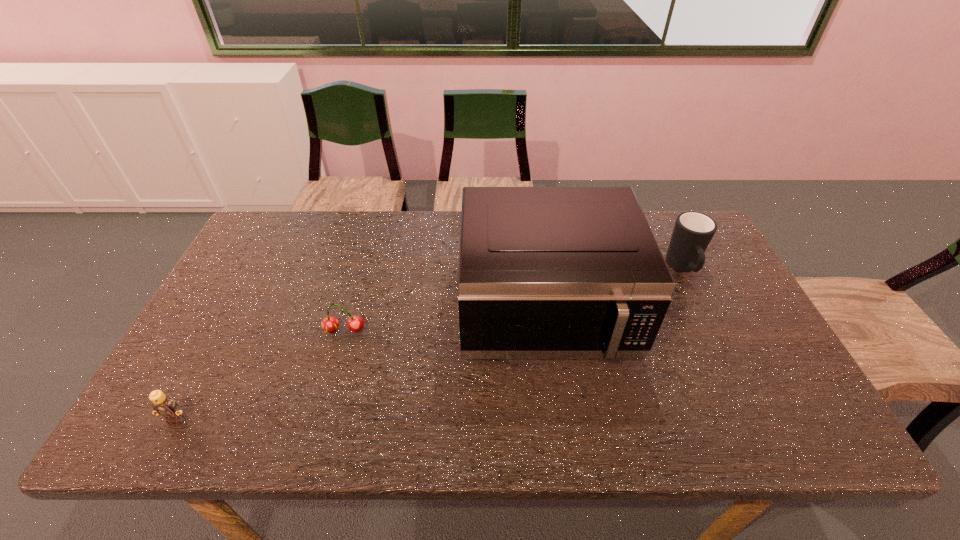
At what (x,y) coordinates should I click in order to perform the action: click on free space between the tallest object and the cherry. Please return your answer as a coordinate pair (x, y). The width and height of the screenshot is (960, 540). Looking at the image, I should click on (444, 322).

What are the coordinates of `empty location between the third object from right to left and the leftmost object` in the screenshot? It's located at (x=260, y=374).

Locate an element on the screen. The height and width of the screenshot is (540, 960). vacant point located between the rightmost object and the nearest object is located at coordinates (430, 344).

Locate an element on the screen. The width and height of the screenshot is (960, 540). vacant area that lies between the second tallest object and the nearest object is located at coordinates 430,344.

Locate an element on the screen. free area in between the second tallest object and the Lego is located at coordinates (430, 344).

Locate an element on the screen. Image resolution: width=960 pixels, height=540 pixels. free space between the nearest object and the second object from left to right is located at coordinates (260, 374).

Find the location of a particular element. The height and width of the screenshot is (540, 960). vacant area that lies between the cherry and the tallest object is located at coordinates (444, 322).

Identify which object is located as the nearest to the tallest object. Please provide its 2D coordinates. Your answer should be formatted as a tuple, i.e. [(x, y)], where the tuple contains the x and y coordinates of a point satisfying the conditions above.

[(693, 231)]

Where is `object that stands as the second closest to the Lego`? object that stands as the second closest to the Lego is located at coordinates (544, 272).